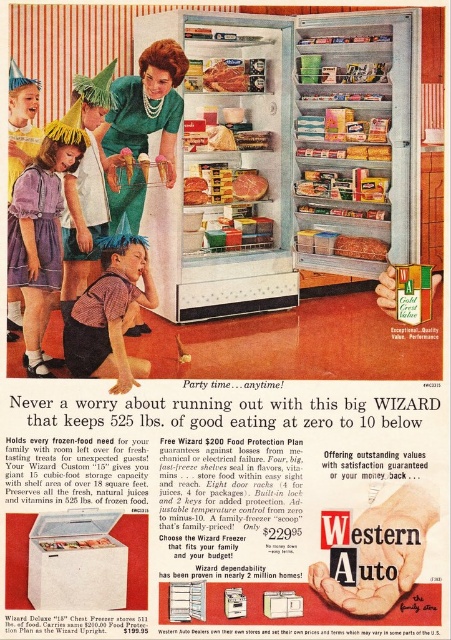
Question: Which point appears farthest from the camera in this image?

Choices:
 (A) (234, 179)
 (B) (173, 173)
 (C) (344, 244)

Answer: (A)

Question: Which of the following is the closest to the observer?

Choices:
 (A) (96, 538)
 (B) (87, 198)

Answer: (A)

Question: Which of the following is the farthest from the observer?

Choices:
 (A) matte yellow party hat at lower left
 (B) white metallic refrigerator at center
 (C) smoked meat at center
 (D) smooth plastic container at center

Answer: (D)

Question: Can you confirm if matte yellow party hat at lower left is positioned below smooth plastic container at center?

Choices:
 (A) no
 (B) yes

Answer: (B)

Question: Is purple cotton dress at lower left further to camera compared to green fabric dress at center?

Choices:
 (A) yes
 (B) no

Answer: (B)

Question: Does green fabric dress at center lie in front of raw meat at center?

Choices:
 (A) yes
 (B) no

Answer: (A)